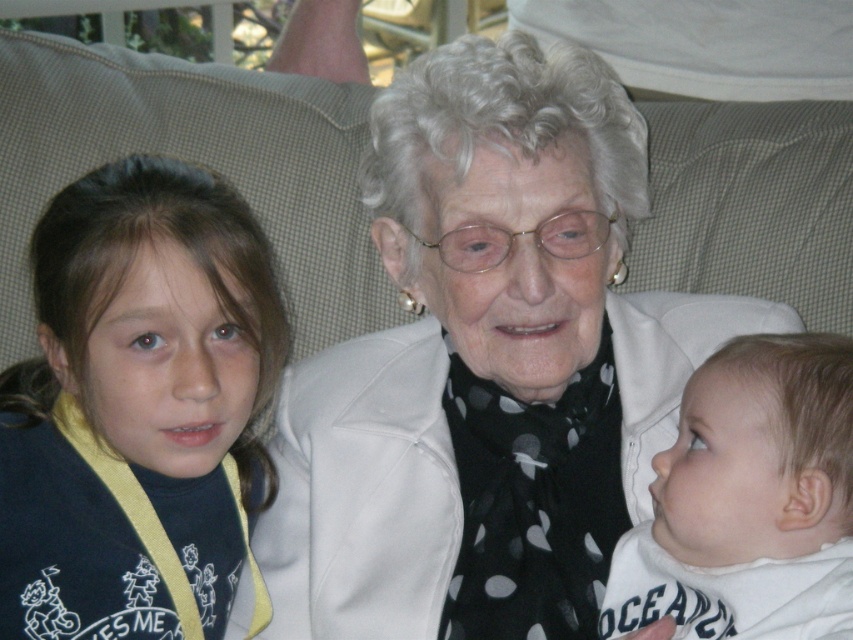
Is white matte jacket at center below white soft fabric at right?

No.

You are a GUI agent. You are given a task and a screenshot of the screen. Output one action in this format:
    pyautogui.click(x=<x>, y=<y>)
    Task: Click on the white matte jacket at center
    
    Given the screenshot: What is the action you would take?
    pyautogui.click(x=486, y=365)

Between dark blue fabric shirt at left and white soft fabric at right, which one is positioned higher?

dark blue fabric shirt at left is higher up.

Which of these two, dark blue fabric shirt at left or white soft fabric at right, stands taller?

dark blue fabric shirt at left

What are the coordinates of `dark blue fabric shirt at left` in the screenshot? It's located at (137, 408).

Locate an element on the screen. The height and width of the screenshot is (640, 853). dark blue fabric shirt at left is located at coordinates click(x=137, y=408).

Does point (416, 220) lie in front of point (260, 284)?

No, (416, 220) is further to viewer.

Does point (611, 168) come farther from viewer compared to point (225, 564)?

No.

Locate an element on the screen. Image resolution: width=853 pixels, height=640 pixels. white matte jacket at center is located at coordinates (486, 365).